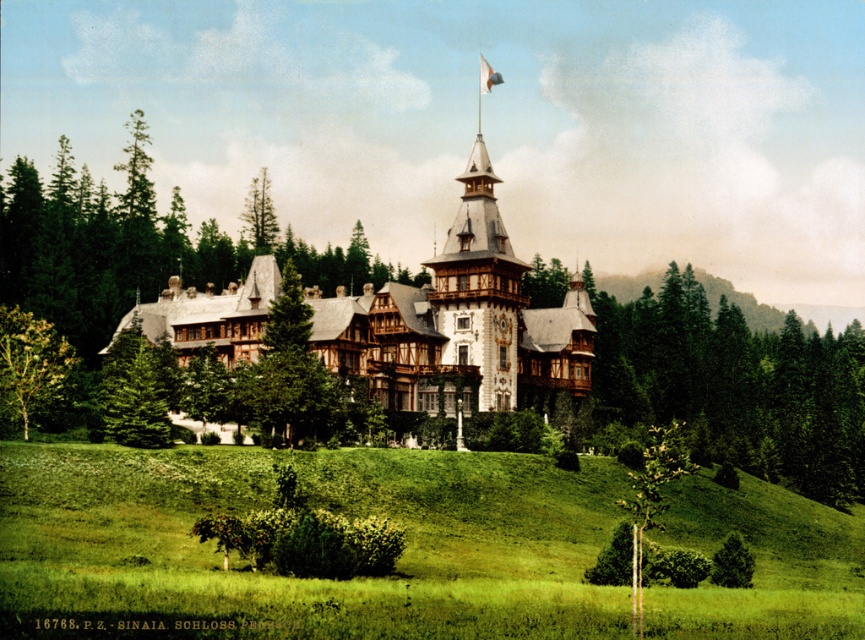
You are standing in front of the historic building and notice two points marked on the image. The first point is at coordinates point [260,234] and the second is at point [492,80]. Which of these two points is nearer to your current position?

Point [260,234] is closer to the camera than point [492,80], so the first point is nearer to your current position.

You are a drone operator tasked with capturing aerial footage of the historic building. Your drone has a maximum flight range of 100 feet from its starting position. If you position the drone at the green textured pine tree at center, will it be able to fly to the white fabric flag at upper center without exceeding its range?

The distance between the green textured pine tree at center and the white fabric flag at upper center is 120.66 feet, which exceeds the drone operator s maximum flight range of 100 feet. Therefore, the drone cannot reach the white fabric flag at upper center from the green textured pine tree at center without exceeding its range.

You are a landscape architect planning to place a new sculpture in the garden of the castle. You have two options for locations based on the image provided. The first option is on the green grassy hillside at center, and the second is near the green wood tree at center. Considering the size of the areas, which location would allow for a larger sculpture without overcrowding the space?

The green grassy hillside at center is larger in size than the green wood tree at center, so placing the sculpture on the green grassy hillside at center would allow for a larger sculpture without overcrowding the space.